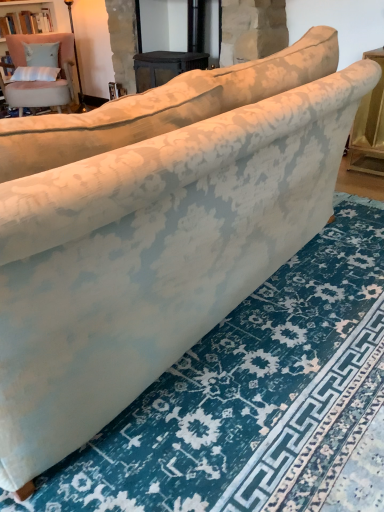
Describe the element at coordinates (41, 81) in the screenshot. The height and width of the screenshot is (512, 384). I see `velvet pink chair at upper left` at that location.

Locate an element on the screen. The height and width of the screenshot is (512, 384). velvet pink chair at upper left is located at coordinates (41, 81).

Find the location of a particular element. Image resolution: width=384 pixels, height=512 pixels. velvet pink chair at upper left is located at coordinates (41, 81).